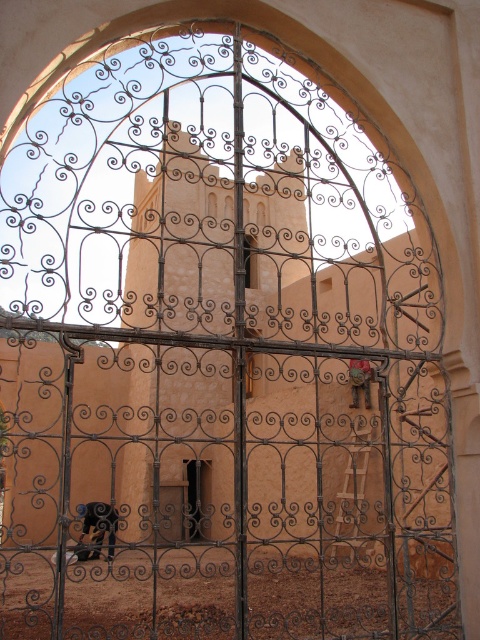
Who is lower down, smooth wood door at center or dark brown wrought iron door at center?

smooth wood door at center is below.

Does smooth wood door at center have a greater height compared to dark brown wrought iron door at center?

No.

Which is behind, point (187, 472) or point (169, 513)?

The point (187, 472) is more distant.

Where is `smooth wood door at center`? This screenshot has width=480, height=640. smooth wood door at center is located at coordinates (199, 499).